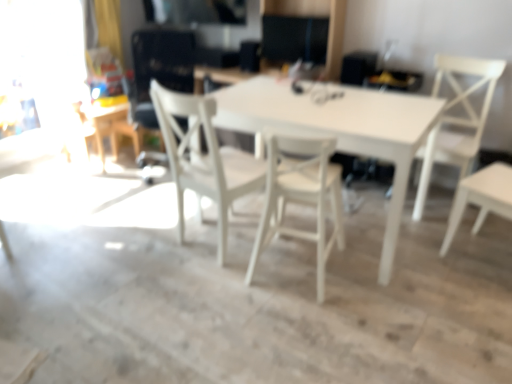
What do you see at coordinates (344, 132) in the screenshot? The width and height of the screenshot is (512, 384). I see `white matte table at center, marked as the second table in a left-to-right arrangement` at bounding box center [344, 132].

Where is `white wood chair at center, the 2th chair from the left`? Image resolution: width=512 pixels, height=384 pixels. white wood chair at center, the 2th chair from the left is located at coordinates (301, 196).

Describe the element at coordinates (46, 61) in the screenshot. I see `transparent glass door at upper left` at that location.

What do you see at coordinates (100, 124) in the screenshot? This screenshot has width=512, height=384. I see `white matte table at upper left, which ranks as the 1th table in back-to-front order` at bounding box center [100, 124].

Where is `white wood chair at center, placed as the 3th chair when sorted from right to left`? This screenshot has height=384, width=512. white wood chair at center, placed as the 3th chair when sorted from right to left is located at coordinates (204, 158).

I want to click on white matte table at center, marked as the second table in a left-to-right arrangement, so click(x=344, y=132).

From a real-world perspective, does white matte chair at right, arranged as the third chair when viewed from the left, sit lower than white wood chair at center, positioned as the second chair in right-to-left order?

Actually, white matte chair at right, arranged as the third chair when viewed from the left, is physically above white wood chair at center, positioned as the second chair in right-to-left order, in the real world.

Is white matte chair at right, arranged as the third chair when viewed from the left, facing away from white wood chair at center, the 2th chair from the left?

No, white wood chair at center, the 2th chair from the left, is not at the back of white matte chair at right, arranged as the third chair when viewed from the left.

Considering the relative positions of white matte chair at right, acting as the first chair starting from the right, and white wood chair at center, positioned as the second chair in right-to-left order, in the image provided, is white matte chair at right, acting as the first chair starting from the right, to the right of white wood chair at center, positioned as the second chair in right-to-left order, from the viewer's perspective?

Yes, white matte chair at right, acting as the first chair starting from the right, is to the right of white wood chair at center, positioned as the second chair in right-to-left order.

Is white matte chair at right, arranged as the third chair when viewed from the left, next to white wood chair at center, the 2th chair from the left, and touching it?

No, white matte chair at right, arranged as the third chair when viewed from the left, is not beside white wood chair at center, the 2th chair from the left.

Is white wood chair at center, placed as the 3th chair when sorted from right to left, spatially inside white matte chair at right, arranged as the third chair when viewed from the left, or outside of it?

white wood chair at center, placed as the 3th chair when sorted from right to left, is spatially situated outside white matte chair at right, arranged as the third chair when viewed from the left.

Considering the sizes of objects white wood chair at center, which ranks as the 1th chair in left-to-right order, and white matte chair at right, arranged as the third chair when viewed from the left, in the image provided, who is thinner, white wood chair at center, which ranks as the 1th chair in left-to-right order, or white matte chair at right, arranged as the third chair when viewed from the left,?

With smaller width is white wood chair at center, which ranks as the 1th chair in left-to-right order.

Locate an element on the screen. The width and height of the screenshot is (512, 384). the 1st chair in front of the white matte chair at right, acting as the first chair starting from the right is located at coordinates (204, 158).

From a real-world perspective, is transparent glass door at upper left physically located above or below white matte table at upper left, positioned as the 2th table in front-to-back order?

In terms of real-world spatial position, transparent glass door at upper left is above white matte table at upper left, positioned as the 2th table in front-to-back order.

From the image's perspective, is transparent glass door at upper left above white matte table at upper left, positioned as the 2th table in front-to-back order?

Correct, transparent glass door at upper left appears higher than white matte table at upper left, positioned as the 2th table in front-to-back order, in the image.

Visually, is transparent glass door at upper left positioned to the left or to the right of white matte table at upper left, the 1th table positioned from the left?

Based on their positions, transparent glass door at upper left is located to the left of white matte table at upper left, the 1th table positioned from the left.

Can you confirm if transparent glass door at upper left is taller than white matte table at upper left, which appears as the 2th table when viewed from the right?

Yes.

Choose the correct answer: Is white matte table at center, which is the 1th table from front to back, inside white wood chair at center, positioned as the second chair in right-to-left order, or outside it?

white matte table at center, which is the 1th table from front to back, exists outside the volume of white wood chair at center, positioned as the second chair in right-to-left order.

In terms of size, does white matte table at center, which is the 1th table from front to back, appear bigger or smaller than white wood chair at center, the 2th chair from the left?

white matte table at center, which is the 1th table from front to back, is bigger than white wood chair at center, the 2th chair from the left.

Which is more to the right, white matte table at center, the 2th table from the back, or white wood chair at center, the 2th chair from the left?

From the viewer's perspective, white matte table at center, the 2th table from the back, appears more on the right side.

From a real-world perspective, which object rests below the other?

In real-world perspective, white matte table at center, the 2th table from the back, is lower.

Would you say transparent glass door at upper left is to the left or to the right of white wood chair at center, which ranks as the 1th chair in left-to-right order, in the picture?

In the image, transparent glass door at upper left appears on the left side of white wood chair at center, which ranks as the 1th chair in left-to-right order.

Is the surface of transparent glass door at upper left in direct contact with white wood chair at center, which ranks as the 1th chair in left-to-right order?

No, transparent glass door at upper left is not making contact with white wood chair at center, which ranks as the 1th chair in left-to-right order.

Can you confirm if transparent glass door at upper left is shorter than white wood chair at center, which ranks as the 1th chair in left-to-right order?

No, transparent glass door at upper left is not shorter than white wood chair at center, which ranks as the 1th chair in left-to-right order.

Which is closer, [221,79] or [426,183]?

Clearly, point [221,79] is more distant from the camera than point [426,183].

Can you tell me how much white matte table at center, marked as the second table in a left-to-right arrangement, and white matte chair at right, acting as the first chair starting from the right, differ in facing direction?

The facing directions of white matte table at center, marked as the second table in a left-to-right arrangement, and white matte chair at right, acting as the first chair starting from the right, are 3.49 degrees apart.

From a real-world perspective, relative to white matte chair at right, arranged as the third chair when viewed from the left, is white matte table at center, positioned as the first table in right-to-left order, vertically above or below?

white matte table at center, positioned as the first table in right-to-left order, is situated lower than white matte chair at right, arranged as the third chair when viewed from the left, in the real world.

Between white matte table at upper left, the 1th table positioned from the left, and white wood chair at center, the 2th chair from the left, which one appears on the left side from the viewer's perspective?

white matte table at upper left, the 1th table positioned from the left, is more to the left.

Considering the sizes of white matte table at upper left, which ranks as the 1th table in back-to-front order, and white wood chair at center, positioned as the second chair in right-to-left order, in the image, is white matte table at upper left, which ranks as the 1th table in back-to-front order, wider or thinner than white wood chair at center, positioned as the second chair in right-to-left order,?

Considering their sizes, white matte table at upper left, which ranks as the 1th table in back-to-front order, looks slimmer than white wood chair at center, positioned as the second chair in right-to-left order.

In the scene shown: Is white wood chair at center, positioned as the second chair in right-to-left order, at the back of white matte table at upper left, the 1th table positioned from the left?

white matte table at upper left, the 1th table positioned from the left, is not turned away from white wood chair at center, positioned as the second chair in right-to-left order.

Are white matte table at upper left, which appears as the 2th table when viewed from the right, and white wood chair at center, positioned as the second chair in right-to-left order, far apart?

Indeed, white matte table at upper left, which appears as the 2th table when viewed from the right, is not near white wood chair at center, positioned as the second chair in right-to-left order.

The width and height of the screenshot is (512, 384). Identify the location of chair that is the 2nd object above the white wood chair at center, positioned as the second chair in right-to-left order (from a real-world perspective). (457, 118).

At what (x,y) coordinates should I click in order to perform the action: click on the 1st chair positioned below the white matte chair at right, acting as the first chair starting from the right (from the image's perspective). Please return your answer as a coordinate pair (x, y). This screenshot has width=512, height=384. Looking at the image, I should click on (204, 158).

Based on their spatial positions, is white matte chair at right, arranged as the third chair when viewed from the left, or white matte table at center, marked as the second table in a left-to-right arrangement, further from white wood chair at center, placed as the 3th chair when sorted from right to left?

white matte chair at right, arranged as the third chair when viewed from the left, lies further to white wood chair at center, placed as the 3th chair when sorted from right to left, than the other object.

Estimate the real-world distances between objects in this image. Which object is closer to transparent glass door at upper left, white wood chair at center, which ranks as the 1th chair in left-to-right order, or white wood chair at center, positioned as the second chair in right-to-left order?

white wood chair at center, which ranks as the 1th chair in left-to-right order, is positioned closer to the anchor transparent glass door at upper left.

Estimate the real-world distances between objects in this image. Which object is further from white wood chair at center, placed as the 3th chair when sorted from right to left, white matte table at upper left, which appears as the 2th table when viewed from the right, or transparent glass door at upper left?

Among the two, transparent glass door at upper left is located further to white wood chair at center, placed as the 3th chair when sorted from right to left.

From the picture: When comparing their distances from white matte table at center, marked as the second table in a left-to-right arrangement, does white wood chair at center, which ranks as the 1th chair in left-to-right order, or white wood chair at center, the 2th chair from the left, seem further?

The object further to white matte table at center, marked as the second table in a left-to-right arrangement, is white wood chair at center, which ranks as the 1th chair in left-to-right order.

Looking at the image, which one is located closer to white wood chair at center, placed as the 3th chair when sorted from right to left, white matte chair at right, arranged as the third chair when viewed from the left, or white wood chair at center, positioned as the second chair in right-to-left order?

white wood chair at center, positioned as the second chair in right-to-left order, lies closer to white wood chair at center, placed as the 3th chair when sorted from right to left, than the other object.

Looking at the image, which one is located closer to transparent glass door at upper left, white wood chair at center, which ranks as the 1th chair in left-to-right order, or white matte table at upper left, positioned as the 2th table in front-to-back order?

white matte table at upper left, positioned as the 2th table in front-to-back order, is closer to transparent glass door at upper left.

Estimate the real-world distances between objects in this image. Which object is further from white wood chair at center, placed as the 3th chair when sorted from right to left, transparent glass door at upper left or white matte table at upper left, the 1th table positioned from the left?

transparent glass door at upper left is further to white wood chair at center, placed as the 3th chair when sorted from right to left.

From the image, which object appears to be nearer to white matte table at upper left, which appears as the 2th table when viewed from the right, white wood chair at center, positioned as the second chair in right-to-left order, or white matte chair at right, acting as the first chair starting from the right?

The object closer to white matte table at upper left, which appears as the 2th table when viewed from the right, is white wood chair at center, positioned as the second chair in right-to-left order.

You are a GUI agent. You are given a task and a screenshot of the screen. Output one action in this format:
    pyautogui.click(x=<x>, y=<y>)
    Task: Click on the chair between white wood chair at center, which ranks as the 1th chair in left-to-right order, and white matte table at center, the 2th table from the back
    The image size is (512, 384).
    Given the screenshot: What is the action you would take?
    pyautogui.click(x=301, y=196)

You are a GUI agent. You are given a task and a screenshot of the screen. Output one action in this format:
    pyautogui.click(x=<x>, y=<y>)
    Task: Click on the table situated between white matte table at upper left, positioned as the 2th table in front-to-back order, and white matte chair at right, arranged as the third chair when viewed from the left, from left to right
    
    Given the screenshot: What is the action you would take?
    pyautogui.click(x=344, y=132)

Find the location of a particular element. table located between white wood chair at center, placed as the 3th chair when sorted from right to left, and white matte chair at right, acting as the first chair starting from the right, in the left-right direction is located at coordinates (344, 132).

Identify the location of table between transparent glass door at upper left and white wood chair at center, the 2th chair from the left, from left to right. The image size is (512, 384). (100, 124).